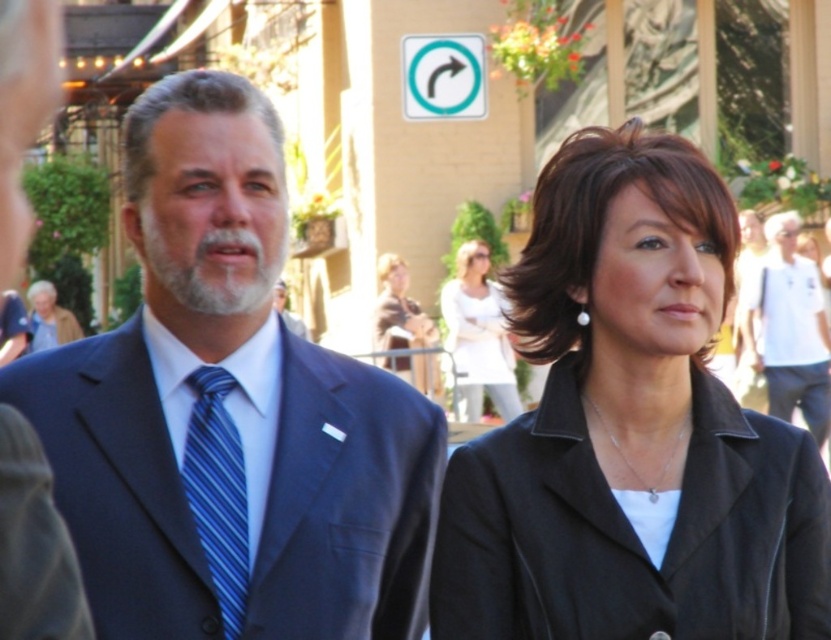
Question: Does matte black blazer at center have a larger size compared to light brown hair at lower left?

Choices:
 (A) no
 (B) yes

Answer: (A)

Question: Does black matte jacket at upper right have a smaller size compared to teal plastic arrow at upper center?

Choices:
 (A) yes
 (B) no

Answer: (B)

Question: Among these points, which one is farthest from the camera?

Choices:
 (A) 446,490
 (B) 768,353
 (C) 471,84

Answer: (C)

Question: Estimate the real-world distances between objects in this image. Which object is closer to the dark blue suit at center?

Choices:
 (A) blue striped tie at center
 (B) matte black blazer at center
 (C) black matte jacket at upper right

Answer: (C)

Question: Considering the real-world distances, which object is closest to the black matte jacket at upper right?

Choices:
 (A) white cotton blouse at center
 (B) teal plastic arrow at upper center
 (C) matte black blazer at center

Answer: (A)

Question: Does dark blue suit at center lie in front of light brown hair at lower left?

Choices:
 (A) yes
 (B) no

Answer: (A)